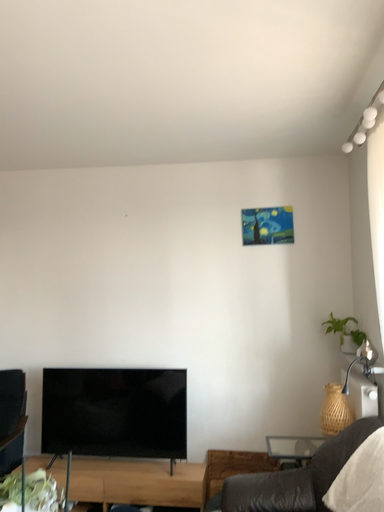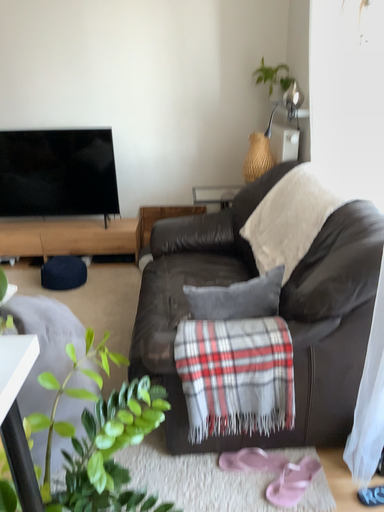
Question: Which way did the camera rotate in the video?

Choices:
 (A) rotated upward
 (B) rotated downward

Answer: (B)